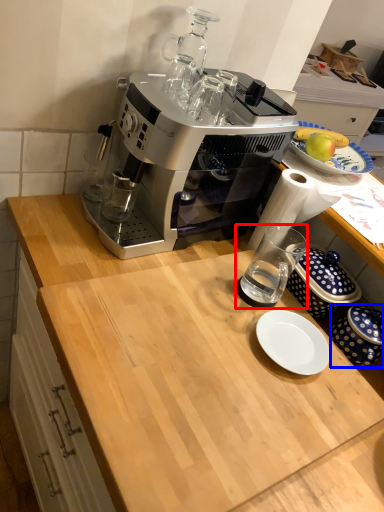
Question: Among these objects, which one is nearest to the camera, coffee cup (highlighted by a red box) or tableware (highlighted by a blue box)?

Choices:
 (A) coffee cup
 (B) tableware

Answer: (B)